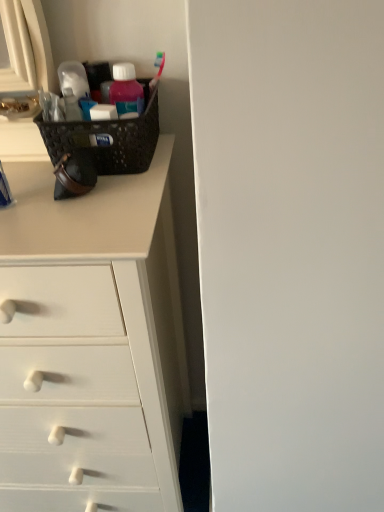
What do you see at coordinates (108, 138) in the screenshot? I see `black plastic basket at upper left` at bounding box center [108, 138].

I want to click on black plastic basket at upper left, so click(x=108, y=138).

Locate an element on the screen. black plastic basket at upper left is located at coordinates (108, 138).